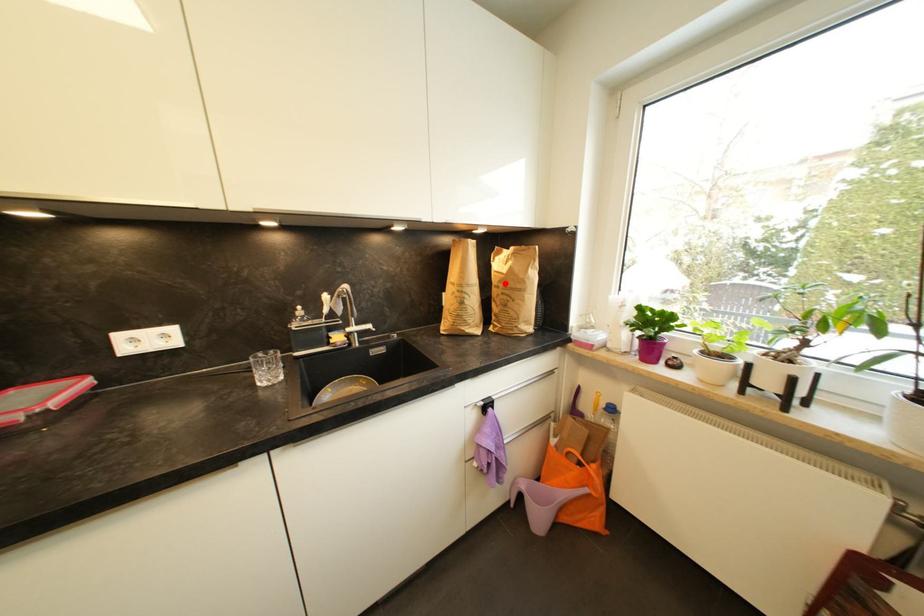
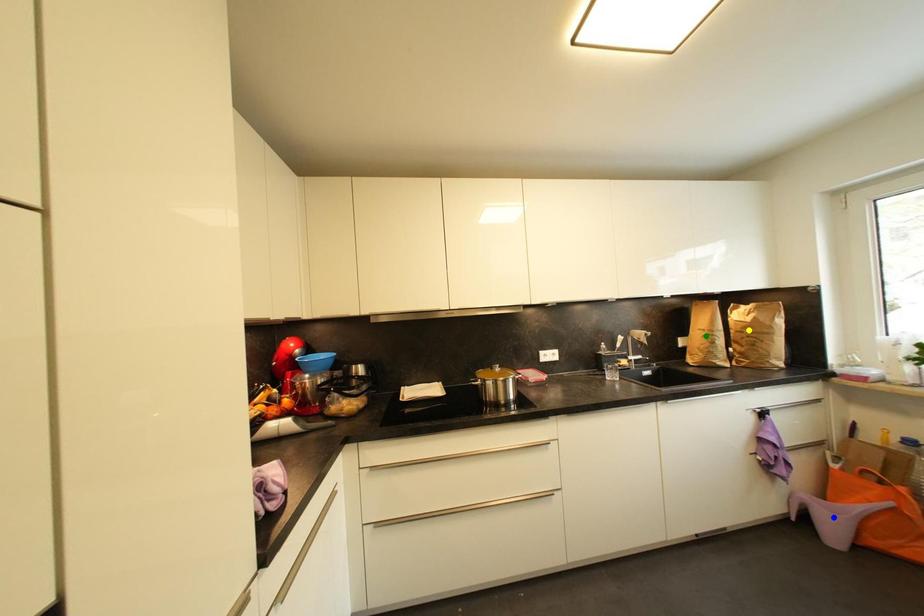
Question: I am providing you with two images of the same scene from different viewpoints. A red point is marked on the first image. You are given multiple points on the second image. Which mark in image 2 goes with the point in image 1?

Choices:
 (A) blue point
 (B) green point
 (C) yellow point

Answer: (C)